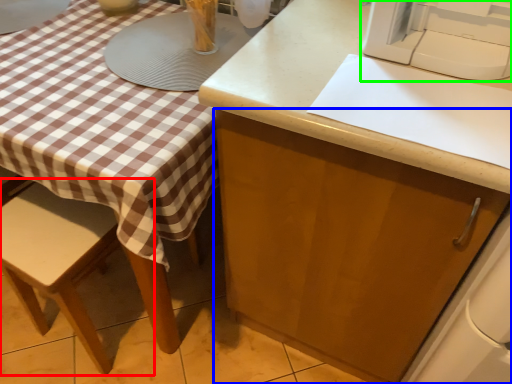
Question: Considering the real-world distances, which object is farthest from chair (highlighted by a red box)? cabinetry (highlighted by a blue box) or sewing machine (highlighted by a green box)?

Choices:
 (A) cabinetry
 (B) sewing machine

Answer: (B)